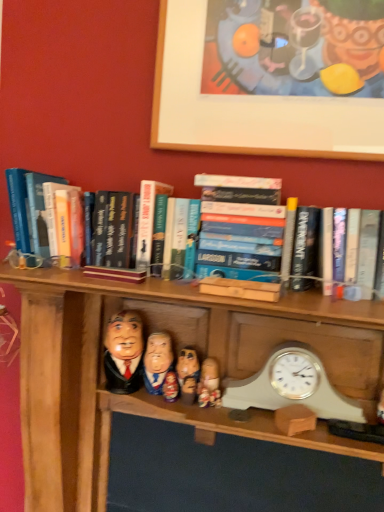
Question: Looking at their shapes, would you say white plastic clock at lower right is wider or thinner than wooden figurine at center, placed as the 3th person when sorted from right to left?

Choices:
 (A) wide
 (B) thin

Answer: (B)

Question: Considering the positions of white plastic clock at lower right and wooden figurine at center, the second person positioned from the left, in the image, is white plastic clock at lower right bigger or smaller than wooden figurine at center, the second person positioned from the left,?

Choices:
 (A) big
 (B) small

Answer: (A)

Question: Estimate the real-world distances between objects in this image. Which object is closer to the white plastic clock at lower right?

Choices:
 (A) hardcover book at center
 (B) wooden doll at center, arranged as the first toy when viewed from the left
 (C) matte plastic head at center, the 1th person viewed from the left
 (D) wooden figurine at center, the 2th toy positioned from the left
 (E) wooden picture frame at upper center

Answer: (D)

Question: Estimate the real-world distances between objects in this image. Which object is closer to the white plastic clock at lower right?

Choices:
 (A) wooden picture frame at upper center
 (B) hardcover books at right
 (C) wooden figurine at center, the 1th toy from the right
 (D) wooden figurine at center, which is counted as the first person, starting from the right
 (E) matte plastic head at center, the fourth person in the right-to-left sequence

Answer: (D)